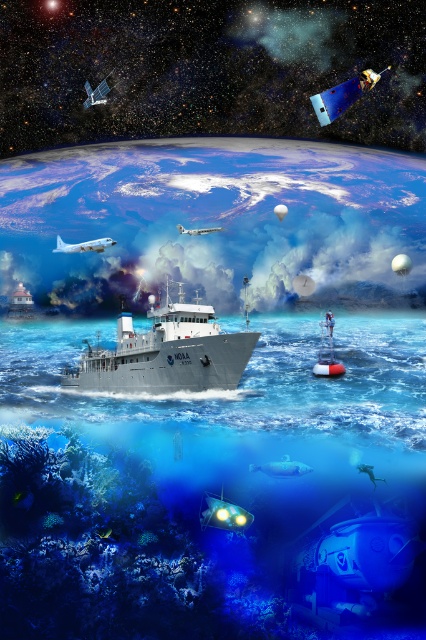
You are a pilot flying one of the airplanes in the scene. You need to determine the safest altitude to avoid colliding with the white matte ship at center while ensuring you stay above the translucent blue water at center. What altitude should you choose?

The translucent blue water at center is taller than the white matte ship at center. To avoid collision with the ship and stay above the water, you should fly at an altitude higher than the translucent blue water at center but lower than the white matte ship at center.

You are a marine biologist on the NOAA ship observing the scene. You notice a point marked at coordinates (207,484). What does this point indicate?

The point at coordinates (207,484) marks translucent blue water at center.